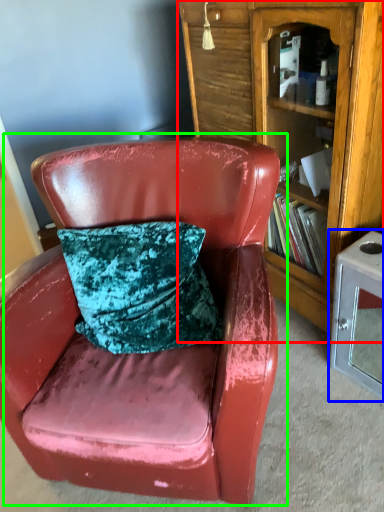
Question: Based on their relative distances, which object is nearer to bookcase (highlighted by a red box)? Choose from table (highlighted by a blue box) and chair (highlighted by a green box).

Choices:
 (A) table
 (B) chair

Answer: (A)